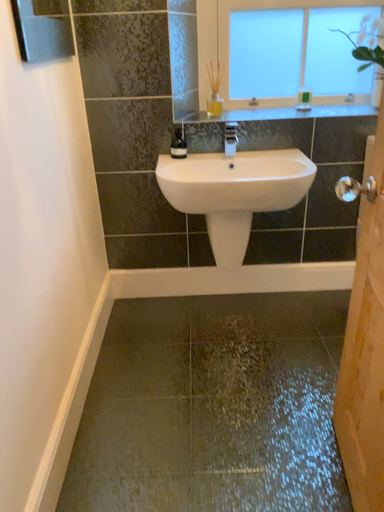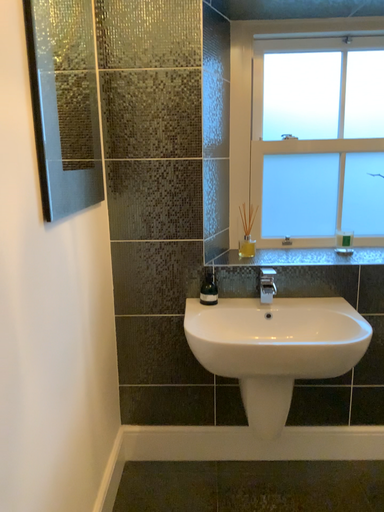
Question: Which way did the camera rotate in the video?

Choices:
 (A) rotated downward
 (B) rotated upward

Answer: (B)